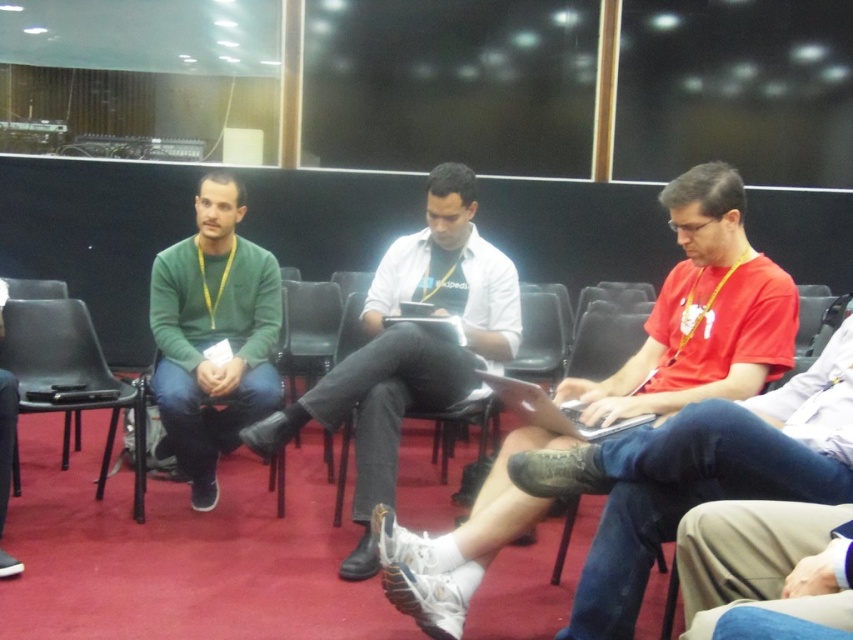
Between point (430, 284) and point (45, 378), which one is positioned behind?

The point (45, 378) is behind.

Describe the element at coordinates (410, 348) in the screenshot. The width and height of the screenshot is (853, 640). I see `white matte shirt at center` at that location.

This screenshot has height=640, width=853. Identify the location of white matte shirt at center. (410, 348).

Which of these two, white matte shirt at center or green matte sweater at center, stands shorter?

With less height is green matte sweater at center.

Describe the element at coordinates (410, 348) in the screenshot. I see `white matte shirt at center` at that location.

Identify the location of white matte shirt at center. (410, 348).

Looking at this image, is matte white laptop at center bigger than black leather chair at center?

Yes, matte white laptop at center is bigger than black leather chair at center.

Measure the distance between matte white laptop at center and camera.

They are 2.02 meters apart.

In order to click on matte white laptop at center in this screenshot , I will do `click(701, 312)`.